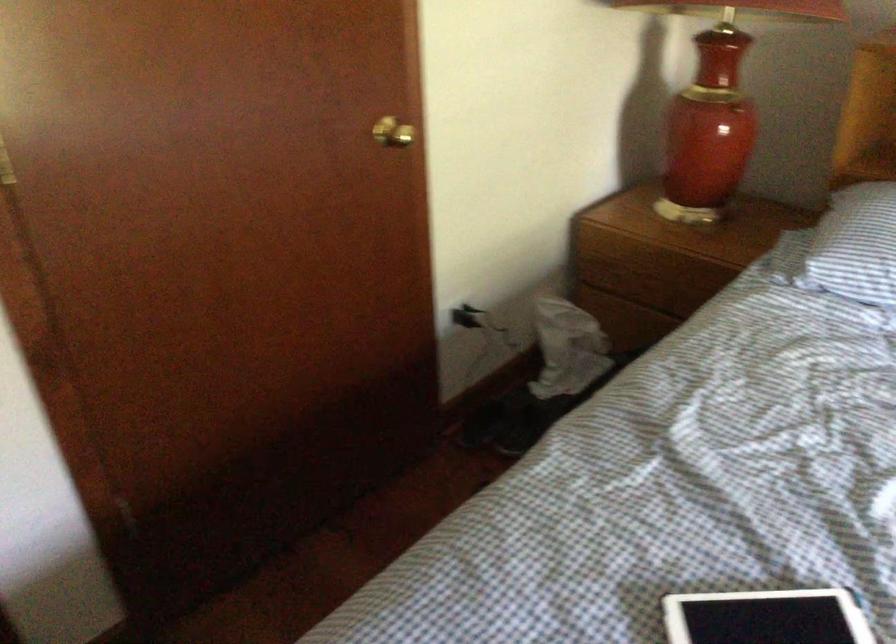
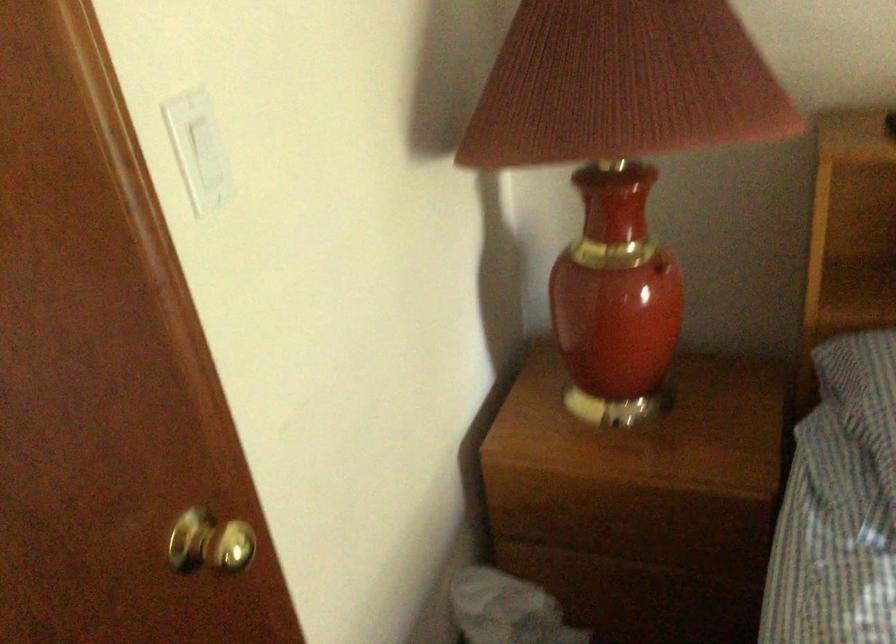
Question: The images are taken continuously from a first-person perspective. In which direction are you moving?

Choices:
 (A) Left
 (B) Right
 (C) Forward
 (D) Backward

Answer: (C)